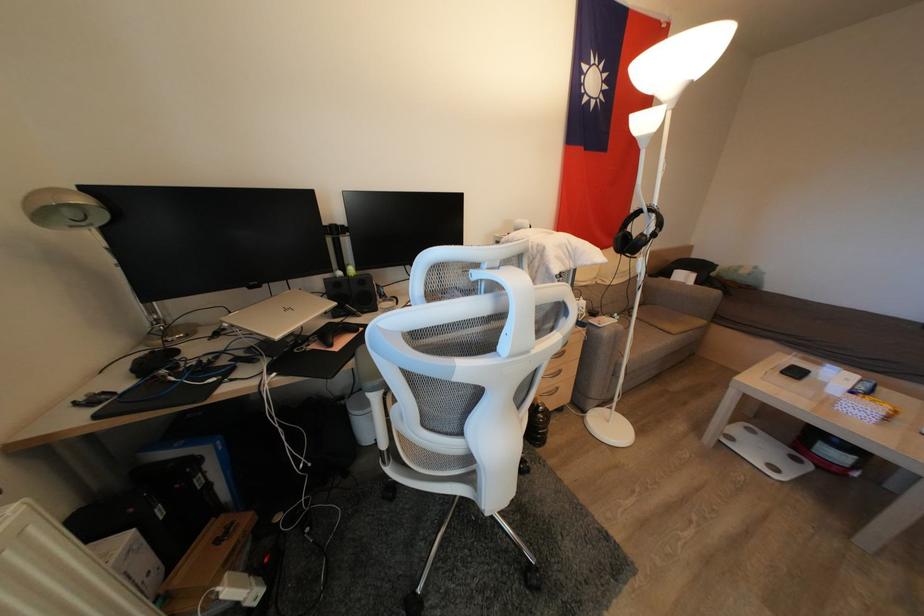
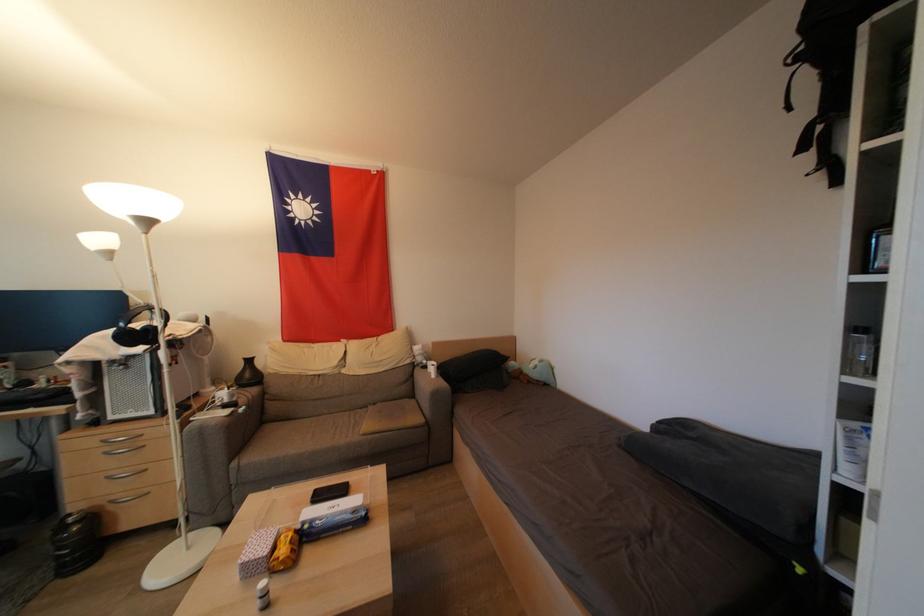
Question: In a continuous first-person perspective shot, in which direction is the camera moving?

Choices:
 (A) Left
 (B) Right
 (C) Forward
 (D) Backward

Answer: (B)